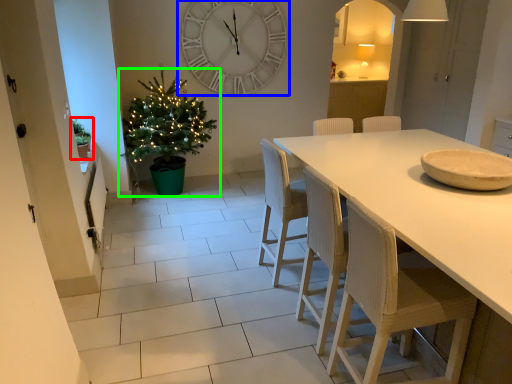
Question: Which object is positioned farthest from houseplant (highlighted by a red box)? Select from wall clock (highlighted by a blue box) and christmas tree (highlighted by a green box).

Choices:
 (A) wall clock
 (B) christmas tree

Answer: (A)